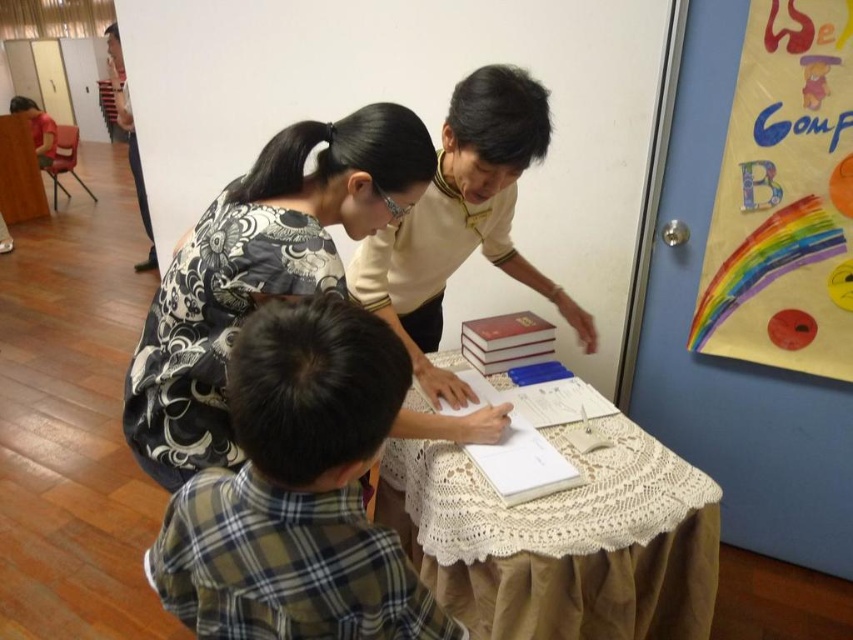
Which is more to the right, matte yellow sweater at upper center or hardcover book at center?

From the viewer's perspective, hardcover book at center appears more on the right side.

The width and height of the screenshot is (853, 640). Describe the element at coordinates (463, 220) in the screenshot. I see `matte yellow sweater at upper center` at that location.

Locate an element on the screen. This screenshot has width=853, height=640. matte yellow sweater at upper center is located at coordinates point(463,220).

Is white lace tablecloth at center above hardcover book at center?

Incorrect, white lace tablecloth at center is not positioned above hardcover book at center.

In the scene shown: Who is higher up, white lace tablecloth at center or hardcover book at center?

hardcover book at center is higher up.

The image size is (853, 640). Find the location of `white lace tablecloth at center`. white lace tablecloth at center is located at coordinates [x=561, y=540].

How much distance is there between white lace tablecloth at center and matte yellow sweater at upper center?

A distance of 15.29 inches exists between white lace tablecloth at center and matte yellow sweater at upper center.

Describe the element at coordinates (561, 540) in the screenshot. I see `white lace tablecloth at center` at that location.

This screenshot has width=853, height=640. Find the location of `white lace tablecloth at center`. white lace tablecloth at center is located at coordinates (561, 540).